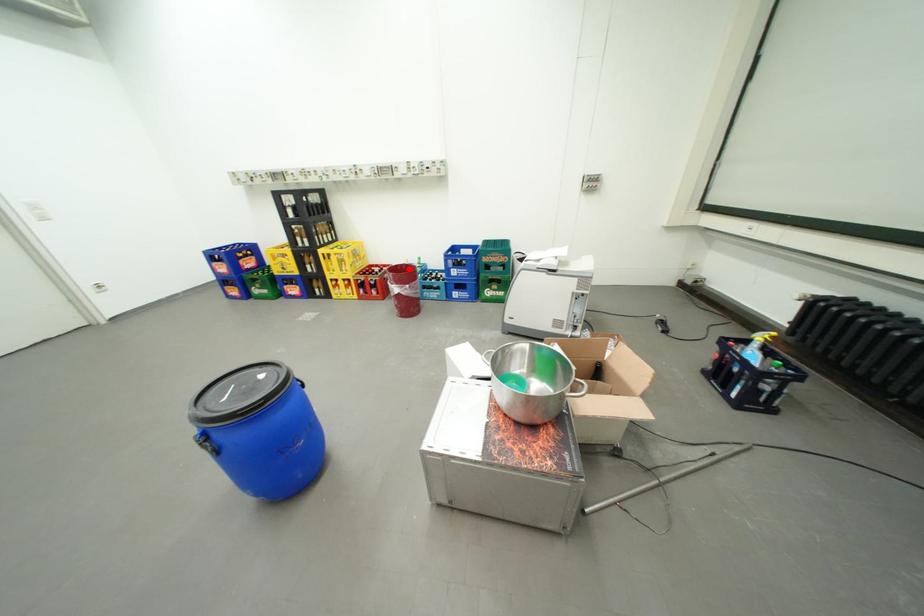
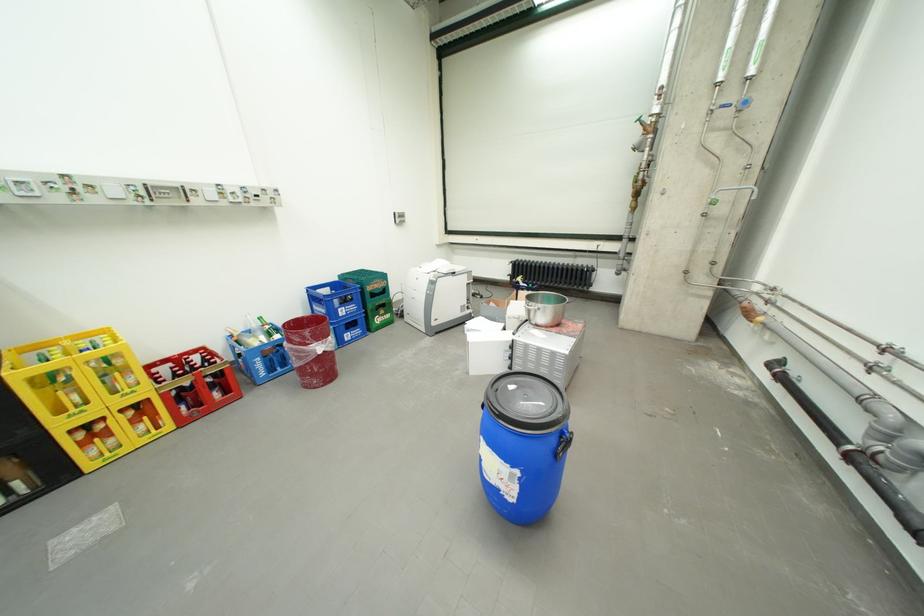
In the second image, find the point that corresponds to the highlighted location in the first image.

(297, 328)